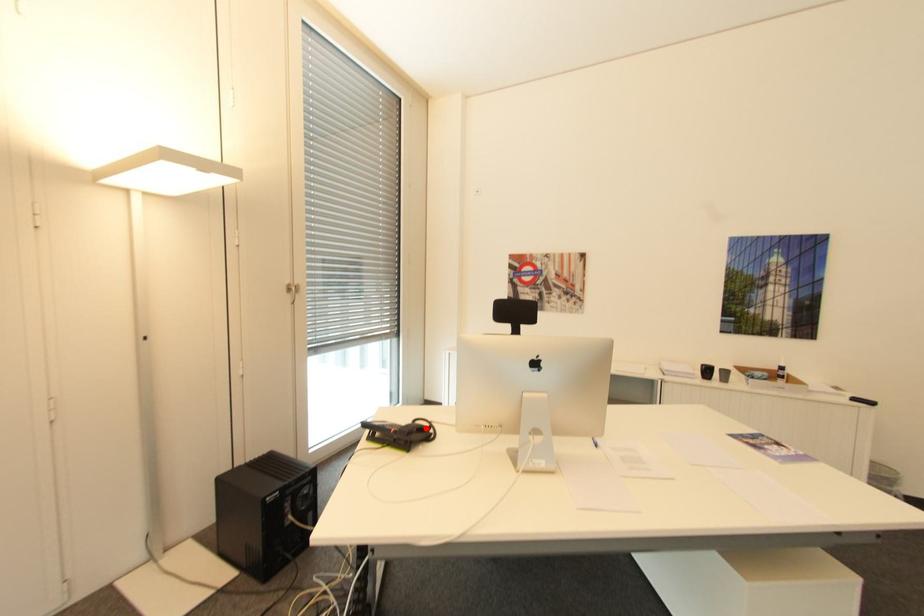
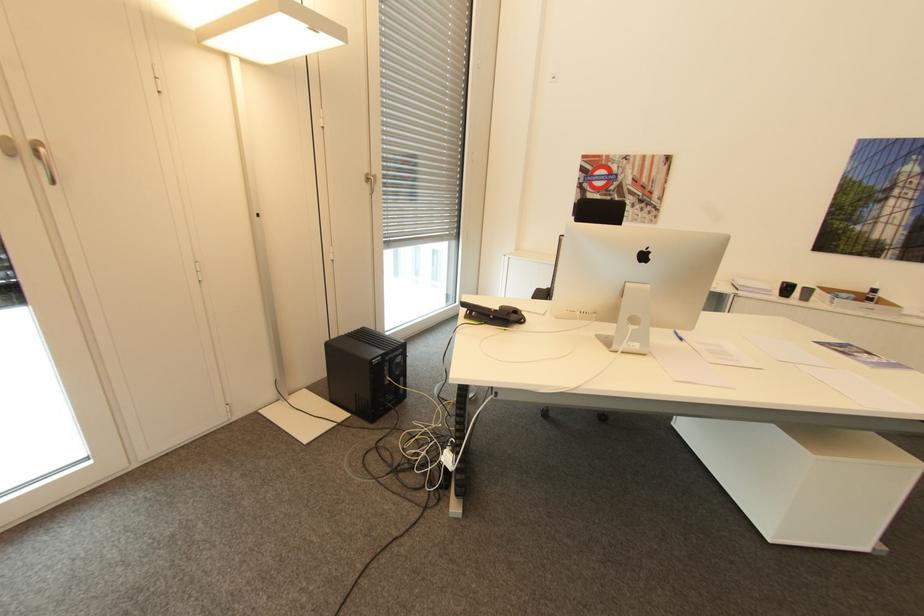
Question: I am providing you with two images of the same scene from different viewpoints. Image1 has a red point marked. In image2, the corresponding 3D location appears at what relative position? Reply with the corresponding letter.

Choices:
 (A) Closer
 (B) Farther

Answer: (B)